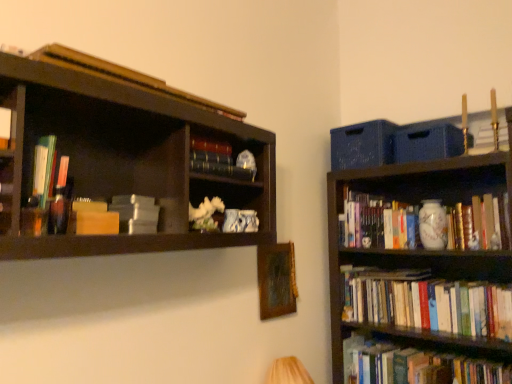
Question: Would you say white paperbacks at lower right, the seventh book viewed from the top, is to the left or to the right of matte gray book at upper left, acting as the fourth book starting from the front, in the picture?

Choices:
 (A) right
 (B) left

Answer: (A)

Question: Is point (456, 288) positioned closer to the camera than point (89, 228)?

Choices:
 (A) farther
 (B) closer

Answer: (A)

Question: Estimate the real-world distances between objects in this image. Which object is farther from the white paperbacks at lower right, the 1th book viewed from the right?

Choices:
 (A) hardcover book at left, the seventh book viewed from the back
 (B) matte plastic books at left, which is the second book from left to right
 (C) matte blue book at center, the 3th book in the top-to-bottom sequence
 (D) hardcover books at center-right, which ranks as the first book in back-to-front order
 (E) matte gray book at upper left, positioned as the third book in left-to-right order

Answer: (A)

Question: Which object is positioned closest to the wooden picture frame at center?

Choices:
 (A) white paperbacks at lower right, the 1th book viewed from the right
 (B) hardcover book at left, placed as the second book when sorted from top to bottom
 (C) wooden book at upper left, marked as the 4th book in a right-to-left arrangement
 (D) matte blue book at center, the 5th book in the bottom-to-top sequence
 (E) matte gray book at upper left, positioned as the third book in left-to-right order

Answer: (A)